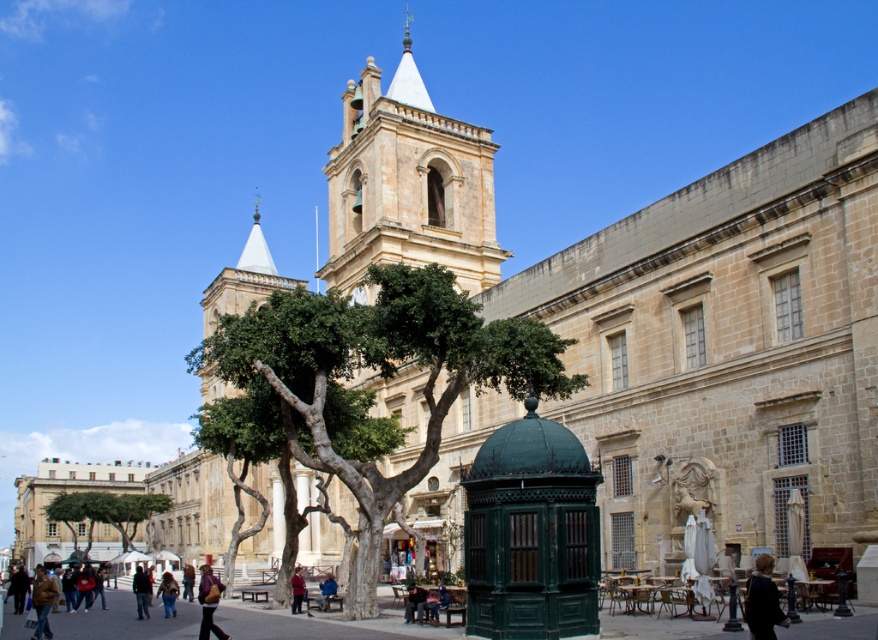
You are a tourist in the historic town square and notice a green leafy tree at center and a blue fabric jacket at lower center. Which object is located to the left of the other?

The green leafy tree at center is positioned on the left side of blue fabric jacket at lower center.

You are standing in the town square and want to take a photo of the beige stone building with the bell tower. You notice two points marked in the scene. The first point is at coordinates point (166,611) and the second is at point (335,589). Which point is closer to you when you are facing the building?

Point (166,611) is closer to the viewer than point (335,589), so it is the closer point when facing the building.